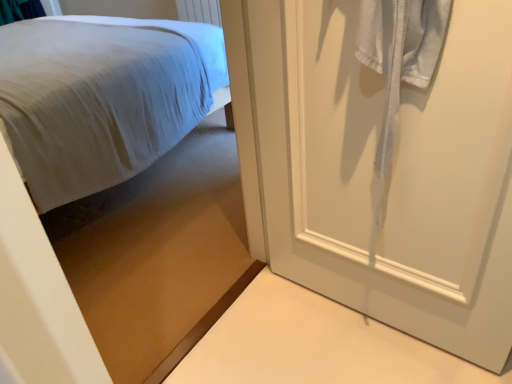
Question: In terms of width, does white matte door at right look wider or thinner when compared to matte white bed at upper left, the second bed from the back?

Choices:
 (A) thin
 (B) wide

Answer: (A)

Question: In terms of size, does white matte door at right appear bigger or smaller than matte white bed at upper left, which is the first bed in front-to-back order?

Choices:
 (A) small
 (B) big

Answer: (A)

Question: Which of these objects is positioned closest to the white matte door at right?

Choices:
 (A) white fabric bed at left, marked as the second bed in a front-to-back arrangement
 (B) matte white bed at upper left, which is the first bed in front-to-back order

Answer: (B)

Question: Based on their relative distances, which object is farther from the matte white bed at upper left, which is the first bed in front-to-back order?

Choices:
 (A) white matte door at right
 (B) white fabric bed at left, which is counted as the first bed, starting from the back

Answer: (A)